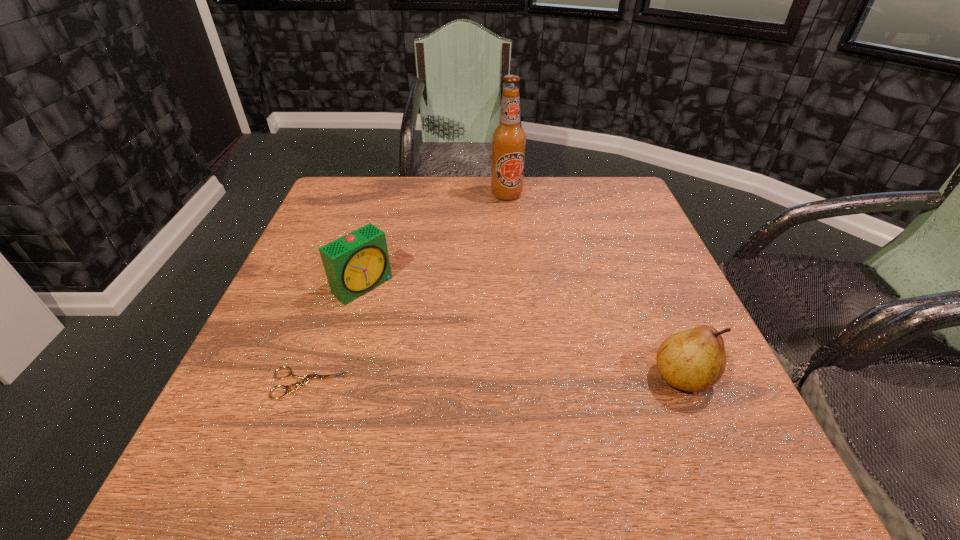
You are a GUI agent. You are given a task and a screenshot of the screen. Output one action in this format:
    pyautogui.click(x=<x>, y=<y>)
    Task: Click on the vacant space on the desktop that is between the shortest object and the pear and is positioned on the front label of the second object from right to left
    Image resolution: width=960 pixels, height=540 pixels.
    Given the screenshot: What is the action you would take?
    (x=540, y=380)

Where is `free space on the desktop that is between the shortest object and the rightmost object and is positioned on the front-facing side of the alarm clock`? free space on the desktop that is between the shortest object and the rightmost object and is positioned on the front-facing side of the alarm clock is located at coordinates (483, 381).